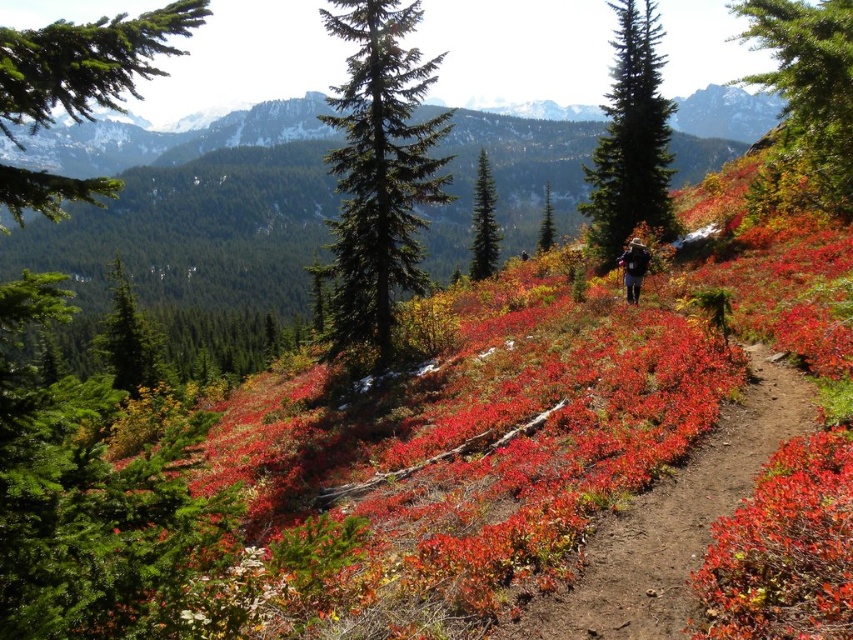
Is green matte tree at left to the left of green textured pine tree at center from the viewer's perspective?

Indeed, green matte tree at left is positioned on the left side of green textured pine tree at center.

Identify the location of green matte tree at left. The height and width of the screenshot is (640, 853). (126, 339).

I want to click on green matte tree at left, so click(126, 339).

Who is higher up, dirt path at center or matte black backpack at center?

matte black backpack at center is above.

Who is lower down, dirt path at center or matte black backpack at center?

dirt path at center is lower down.

Which is in front, point (596, 621) or point (639, 289)?

Point (596, 621)

Where is `dirt path at center`? dirt path at center is located at coordinates (671, 522).

Does green needle-like at center have a lesser width compared to green textured tree at upper right?

Yes.

What do you see at coordinates (379, 168) in the screenshot? Image resolution: width=853 pixels, height=640 pixels. I see `green needle-like at center` at bounding box center [379, 168].

Where is `green needle-like at center`? This screenshot has height=640, width=853. green needle-like at center is located at coordinates (379, 168).

The height and width of the screenshot is (640, 853). Identify the location of green needle-like at center. (379, 168).